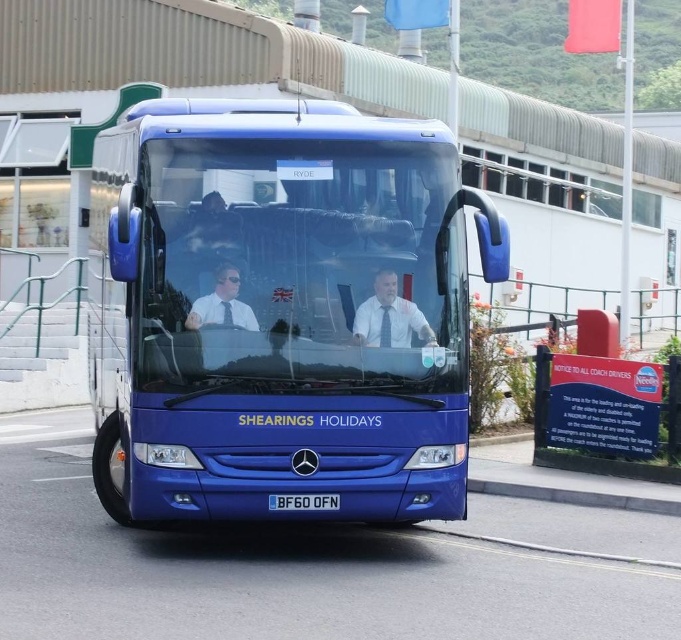
You are standing at the bus stop and see the blue metallic bus at center approaching. If the bus needs to stop completely within 5 meters to pick you up, will it be able to do so?

The blue metallic bus at center is currently 8.14 meters away from you. Since it needs to stop within 5 meters to pick you up, it will not be able to stop in time unless it decelerates significantly.

You are a photographer trying to capture a clear photo of the blue metallic bus at center and the matte white shirt at center. Which object should you focus on first to ensure it appears sharp in the photo?

The blue metallic bus at center has a larger size compared to matte white shirt at center, so you should focus on the blue metallic bus at center first to ensure it appears sharp in the photo.

You are standing in front of the Shearings Holidays bus and want to determine the relative positions of two points on the bus. Which point is closer to you, point at coordinate (x=190, y=317) or point at coordinate (x=315, y=497)?

Point at coordinate (x=190, y=317) is closer to the viewer than point at coordinate (x=315, y=497).